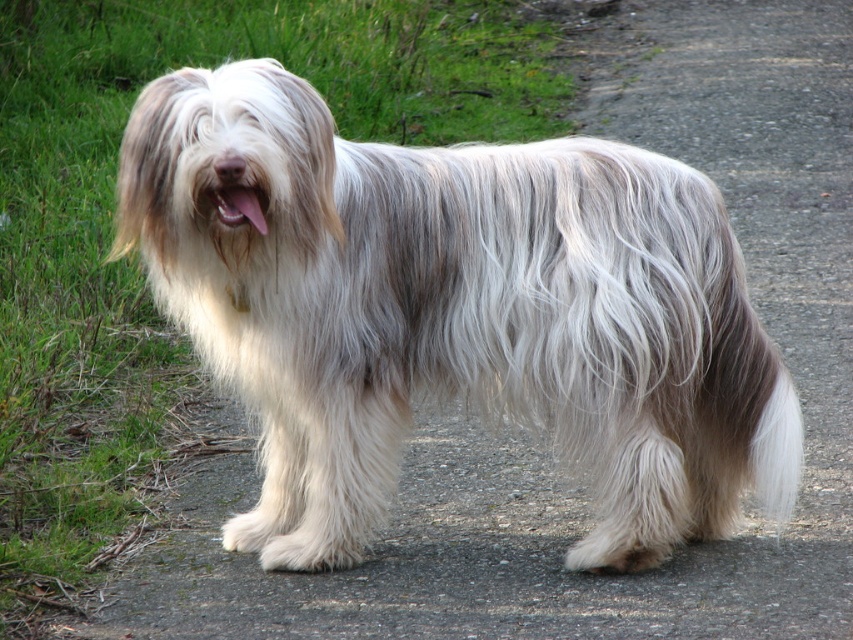
You are a photographer trying to capture the Bearded Collie in the image. You notice the white fluffy tail at lower right and the pink fur at center. Which part of the dog should you focus on first to ensure it appears sharp in the photo?

The white fluffy tail at lower right is closer to the viewer than the pink fur at center, so focusing on the white fluffy tail at lower right first will ensure it appears sharp. Since it is closer, you should focus there to maintain clarity.

You are a photographer trying to capture the fuzzy white dog at center and the pink fur at center in the same frame. Based on their positions, which one should you adjust your camera to focus on first to ensure both are in the shot?

The fuzzy white dog at center is to the right of pink fur at center, so you should focus on the pink fur at center first to ensure both are in the frame by adjusting the camera to include the left side where the pink fur is located and the right side where the fuzzy white dog is positioned.